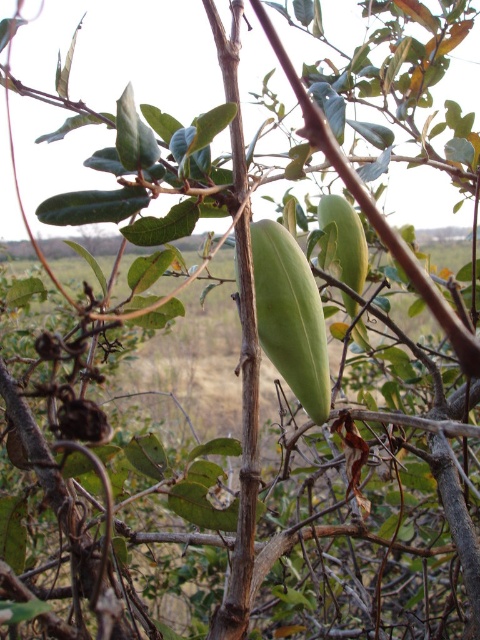
Which is more to the right, green matte pod at center or green matte fruit at center?

green matte fruit at center is more to the right.

Between green matte pod at center and green matte fruit at center, which one has more height?

Standing taller between the two is green matte pod at center.

Which is behind, point (264, 250) or point (350, 225)?

Positioned behind is point (350, 225).

I want to click on green matte pod at center, so click(x=290, y=316).